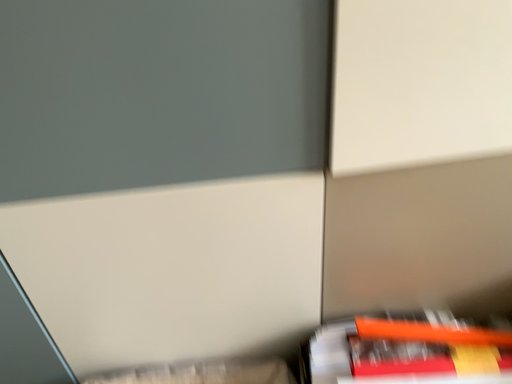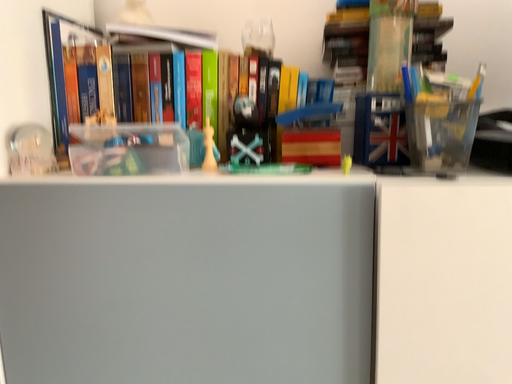
Question: How did the camera likely rotate when shooting the video?

Choices:
 (A) rotated left
 (B) rotated right

Answer: (A)